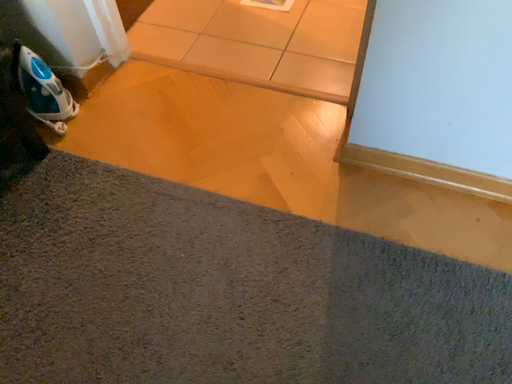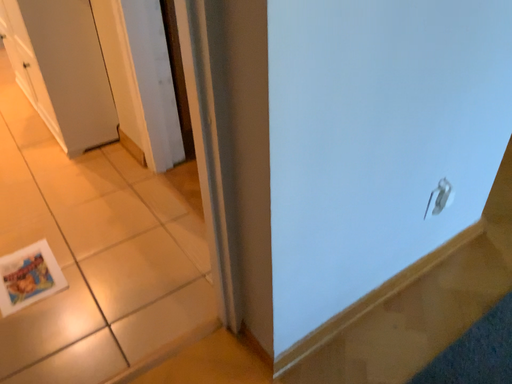
Question: Which way did the camera rotate in the video?

Choices:
 (A) rotated downward
 (B) rotated upward

Answer: (B)